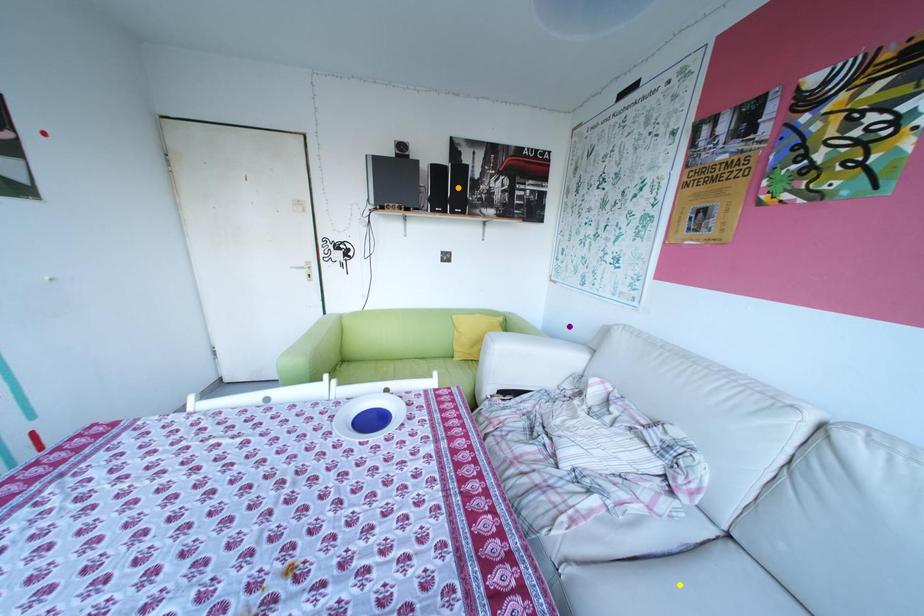
Order these from farthest to nearest:
- yellow point
- orange point
- purple point

purple point, orange point, yellow point